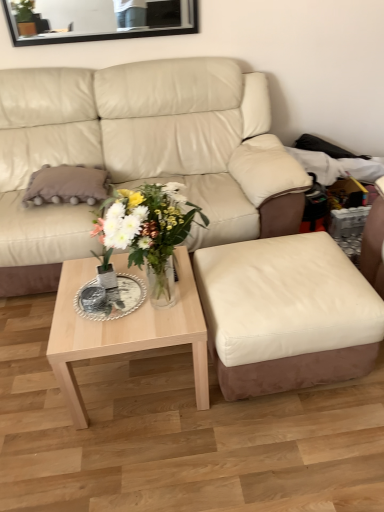
Question: Is beige leather couch at center further to the viewer compared to leather ottoman at center?

Choices:
 (A) yes
 (B) no

Answer: (A)

Question: Is beige leather couch at center far away from leather ottoman at center?

Choices:
 (A) yes
 (B) no

Answer: (B)

Question: Considering the relative sizes of beige leather couch at center and leather ottoman at center in the image provided, is beige leather couch at center smaller than leather ottoman at center?

Choices:
 (A) no
 (B) yes

Answer: (A)

Question: Is leather ottoman at center at the back of beige leather couch at center?

Choices:
 (A) no
 (B) yes

Answer: (A)

Question: Is beige leather couch at center to the right of leather ottoman at center from the viewer's perspective?

Choices:
 (A) no
 (B) yes

Answer: (A)

Question: In terms of width, does clear glass vase at center look wider or thinner when compared to beige leather couch at center?

Choices:
 (A) thin
 (B) wide

Answer: (A)

Question: Relative to beige leather couch at center, is clear glass vase at center in front or behind?

Choices:
 (A) front
 (B) behind

Answer: (A)

Question: Visually, is clear glass vase at center positioned to the left or to the right of beige leather couch at center?

Choices:
 (A) right
 (B) left

Answer: (A)

Question: Is clear glass vase at center inside the boundaries of beige leather couch at center, or outside?

Choices:
 (A) inside
 (B) outside

Answer: (B)

Question: Is black glass mirror at upper center in front of or behind leather ottoman at center in the image?

Choices:
 (A) front
 (B) behind

Answer: (B)

Question: From a real-world perspective, is black glass mirror at upper center above or below leather ottoman at center?

Choices:
 (A) above
 (B) below

Answer: (A)

Question: Is point (26, 13) positioned closer to the camera than point (299, 281)?

Choices:
 (A) closer
 (B) farther

Answer: (B)

Question: In terms of width, does black glass mirror at upper center look wider or thinner when compared to leather ottoman at center?

Choices:
 (A) thin
 (B) wide

Answer: (A)

Question: Considering the positions of light wood/texture coffee table at center and beige leather couch at center in the image, is light wood/texture coffee table at center wider or thinner than beige leather couch at center?

Choices:
 (A) thin
 (B) wide

Answer: (A)

Question: In the image, is light wood/texture coffee table at center on the left side or the right side of beige leather couch at center?

Choices:
 (A) right
 (B) left

Answer: (A)